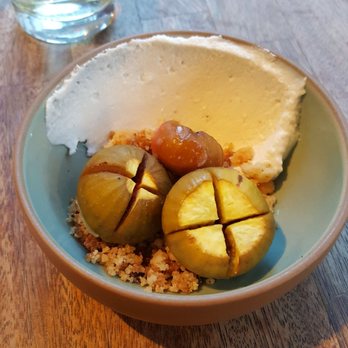
This screenshot has height=348, width=348. I want to click on blue inside of bowl, so click(48, 205).